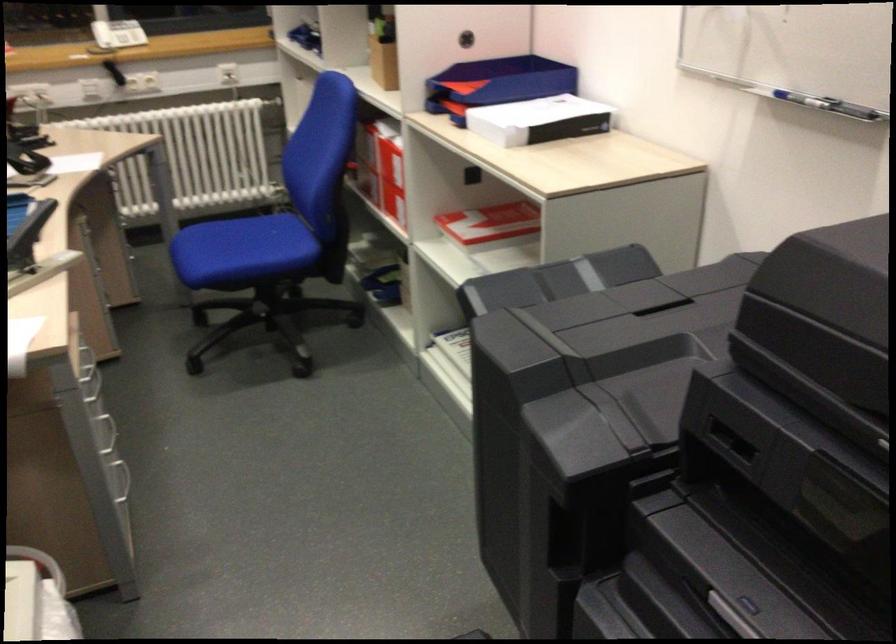
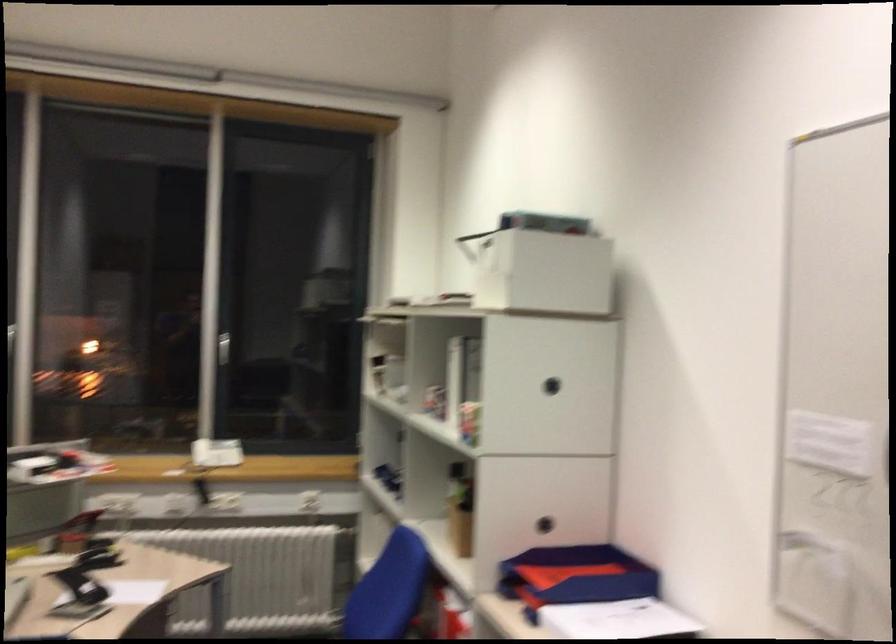
Question: The first image is from the beginning of the video and the second image is from the end. How did the camera likely rotate when shooting the video?

Choices:
 (A) Left
 (B) Right
 (C) Up
 (D) Down

Answer: (C)